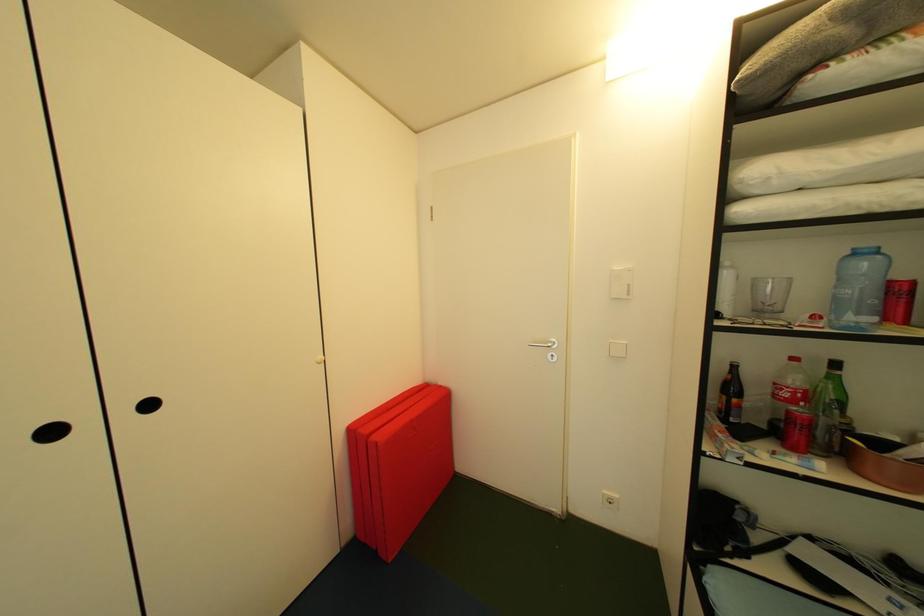
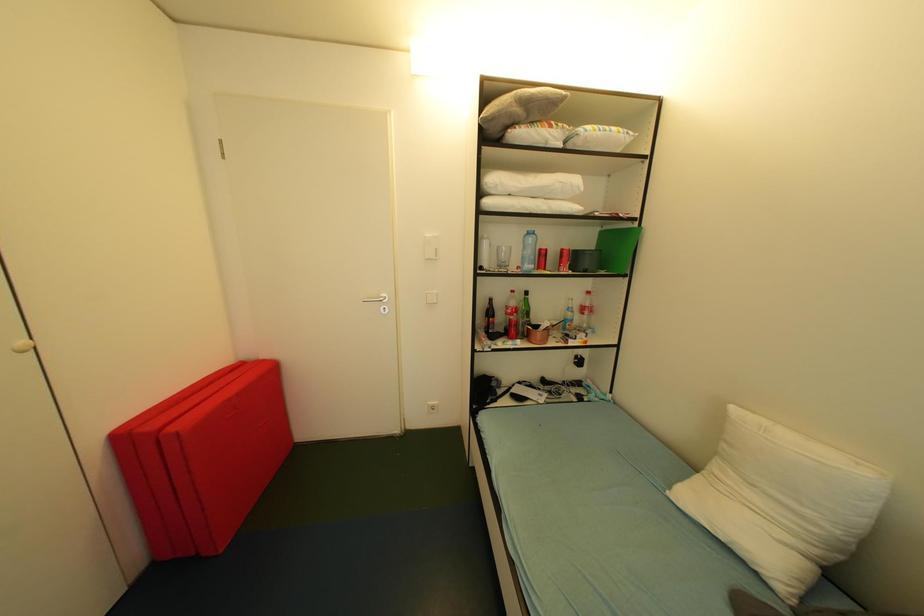
Question: How did the camera likely rotate?

Choices:
 (A) Left
 (B) Right
 (C) Up
 (D) Down

Answer: (B)